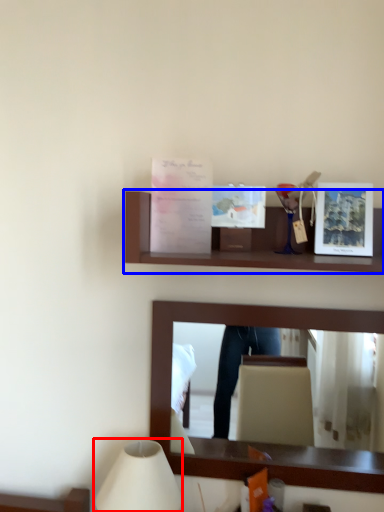
Question: Which of the following is the farthest to the observer, table lamp (highlighted by a red box) or shelf (highlighted by a blue box)?

Choices:
 (A) table lamp
 (B) shelf

Answer: (A)